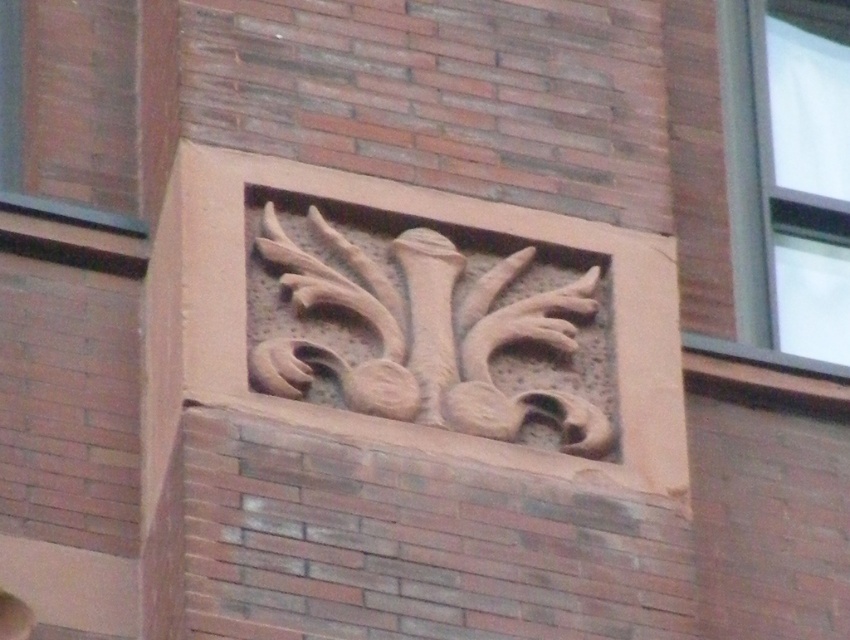
Does brown stone relief at center appear on the right side of clear glass window at upper right?

Incorrect, brown stone relief at center is not on the right side of clear glass window at upper right.

Can you confirm if brown stone relief at center is taller than clear glass window at upper right?

No, brown stone relief at center is not taller than clear glass window at upper right.

This screenshot has width=850, height=640. I want to click on brown stone relief at center, so click(428, 336).

Locate an element on the screen. brown stone relief at center is located at coordinates (428, 336).